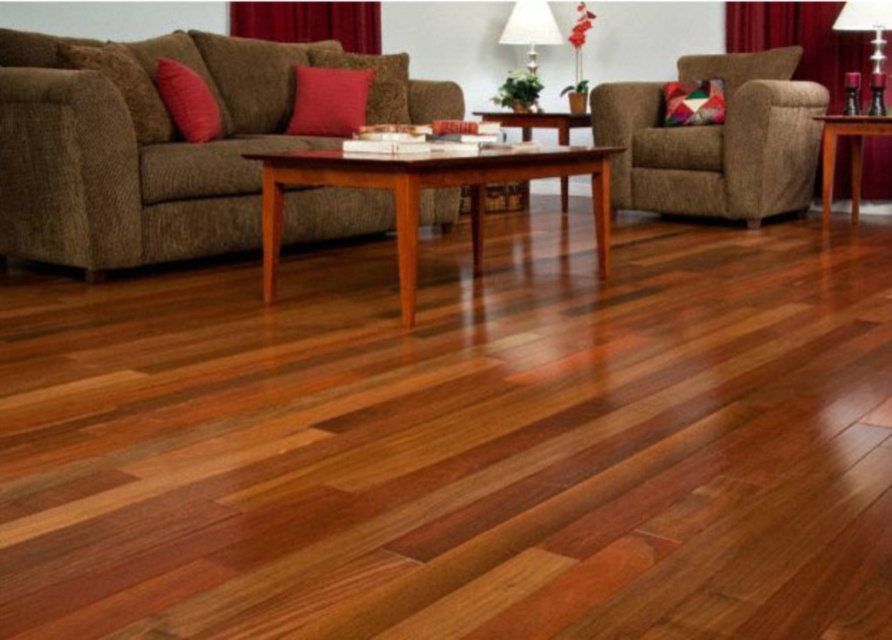
From the picture: Does brown textured armchair at right have a larger size compared to shiny brown wood coffee table at center?

Yes.

Does brown textured armchair at right have a smaller size compared to shiny brown wood coffee table at center?

Actually, brown textured armchair at right might be larger than shiny brown wood coffee table at center.

The image size is (892, 640). I want to click on brown textured armchair at right, so click(716, 140).

Identify the location of brown textured armchair at right. The height and width of the screenshot is (640, 892). (716, 140).

Which is below, brown fabric couch at upper left or shiny brown wood coffee table at center?

shiny brown wood coffee table at center is below.

Does brown fabric couch at upper left appear on the right side of shiny brown wood coffee table at center?

Incorrect, brown fabric couch at upper left is not on the right side of shiny brown wood coffee table at center.

Consider the image. Who is more distant from viewer, (43,163) or (401,230)?

Point (43,163)

The width and height of the screenshot is (892, 640). I want to click on brown fabric couch at upper left, so click(x=159, y=145).

Is point (350, 192) closer to viewer compared to point (756, 202)?

Yes.

Does point (215, 93) lie behind point (783, 93)?

No, (215, 93) is closer to viewer.

I want to click on brown fabric couch at upper left, so click(x=159, y=145).

Locate an element on the screen. This screenshot has height=640, width=892. brown fabric couch at upper left is located at coordinates point(159,145).